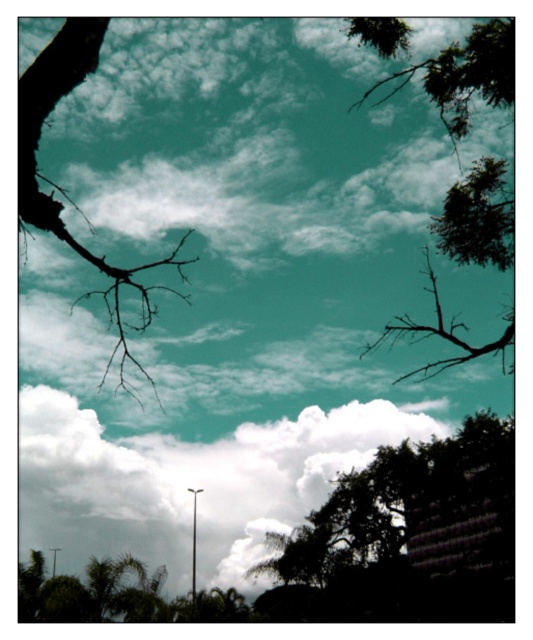
Question: Which point is farther to the camera?

Choices:
 (A) green leafy tree at upper right
 (B) brown/dry wood tree branch at upper right
 (C) white fluffy cloud at center

Answer: (C)

Question: Which object appears farthest from the camera in this image?

Choices:
 (A) green leafy tree at center
 (B) brown/dry wood tree branch at upper right

Answer: (A)

Question: Which of these objects is positioned farthest from the green leafy tree at center?

Choices:
 (A) black matte branch at left
 (B) brown/dry wood tree branch at upper right

Answer: (B)

Question: Can you confirm if green leafy tree at center is positioned above green leafy tree at upper right?

Choices:
 (A) no
 (B) yes

Answer: (A)

Question: Is black matte branch at left closer to camera compared to brown/dry wood tree branch at upper right?

Choices:
 (A) yes
 (B) no

Answer: (A)

Question: Does white fluffy cloud at center have a greater width compared to green leafy tree at center?

Choices:
 (A) no
 (B) yes

Answer: (B)